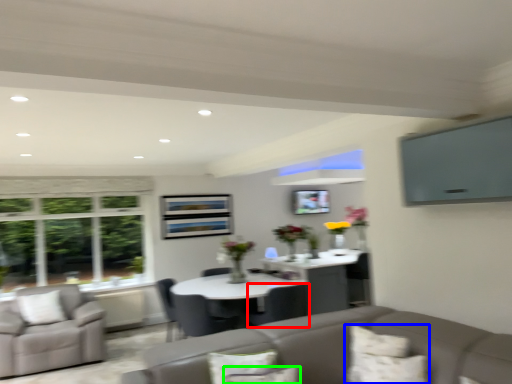
Question: Which object is positioned closest to chair (highlighted by a red box)? Select from pillow (highlighted by a blue box) and pillow (highlighted by a green box).

Choices:
 (A) pillow
 (B) pillow

Answer: (A)